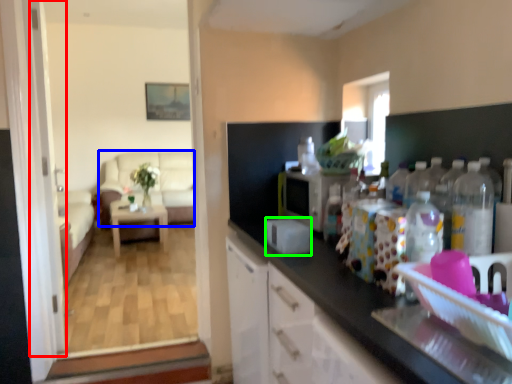
Question: Which object is positioned farthest from screen door (highlighted by a red box)? Select from couch (highlighted by a blue box) and appliance (highlighted by a green box).

Choices:
 (A) couch
 (B) appliance

Answer: (A)